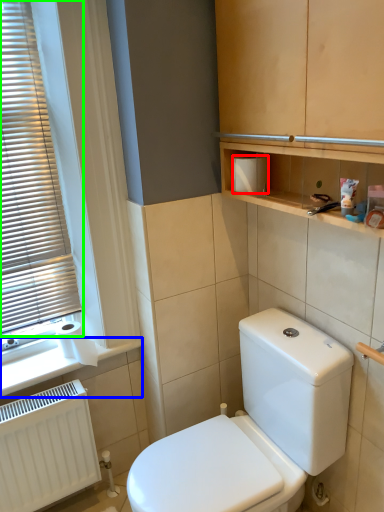
Question: Which object is the farthest from toiletry box (highlighted by a red box)? Choose among these: window sill (highlighted by a blue box) or window blind (highlighted by a green box).

Choices:
 (A) window sill
 (B) window blind

Answer: (A)